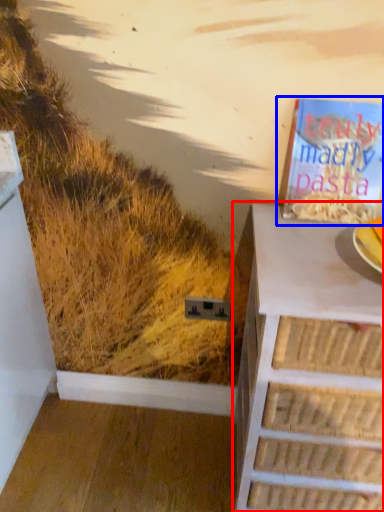
Question: Among these objects, which one is nearest to the camera, chest of drawers (highlighted by a red box) or book (highlighted by a blue box)?

Choices:
 (A) chest of drawers
 (B) book

Answer: (A)